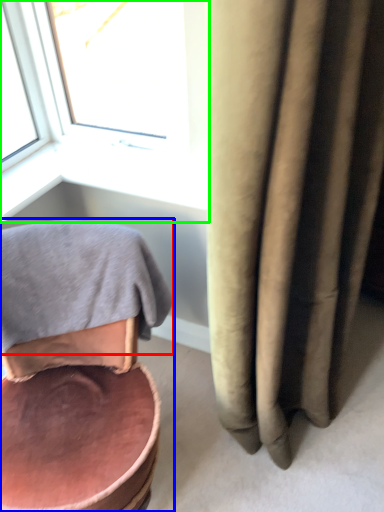
Question: Considering the real-world distances, which object is closest to bath towel (highlighted by a red box)? chair (highlighted by a blue box) or window (highlighted by a green box).

Choices:
 (A) chair
 (B) window

Answer: (A)